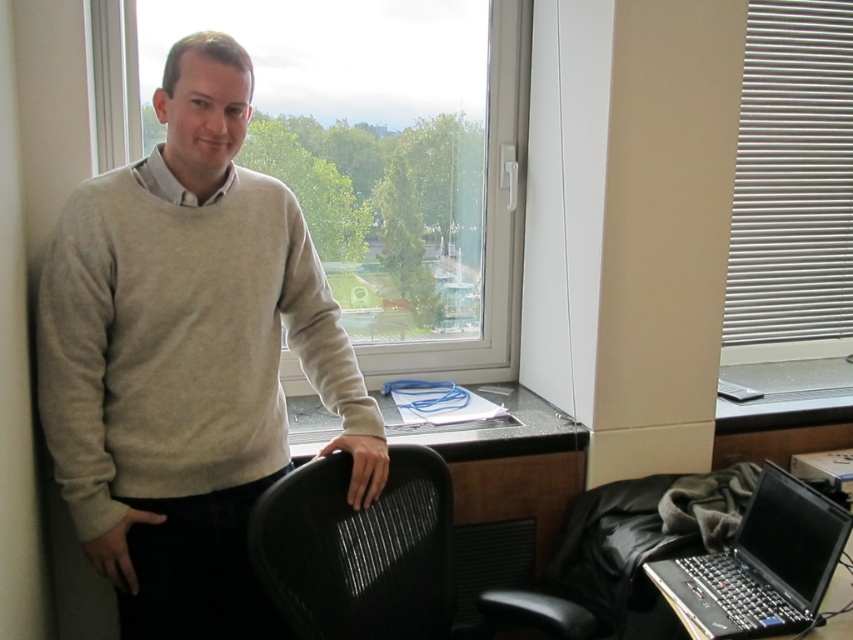
The image size is (853, 640). Describe the element at coordinates (187, 358) in the screenshot. I see `beige sweater at center` at that location.

Measure the distance between beige sweater at center and white plastic blinds at right.

They are 1.78 meters apart.

Is point (341, 337) farther from camera compared to point (840, 147)?

No, it is in front of (840, 147).

Where is `beige sweater at center`? This screenshot has width=853, height=640. beige sweater at center is located at coordinates (187, 358).

Is beige sweater at center to the left of black plastic laptop at lower right from the viewer's perspective?

Correct, you'll find beige sweater at center to the left of black plastic laptop at lower right.

Is point (163, 452) more distant than point (676, 593)?

No, it is not.

What are the coordinates of `beige sweater at center` in the screenshot? It's located at (187, 358).

Does transparent glass window at upper center appear under black plastic laptop at lower right?

No, transparent glass window at upper center is not below black plastic laptop at lower right.

Consider the image. Between transparent glass window at upper center and black plastic laptop at lower right, which one has more height?

transparent glass window at upper center

Is point (503, 189) behind point (764, 477)?

That is True.

The width and height of the screenshot is (853, 640). In order to click on transparent glass window at upper center in this screenshot , I will do `click(368, 154)`.